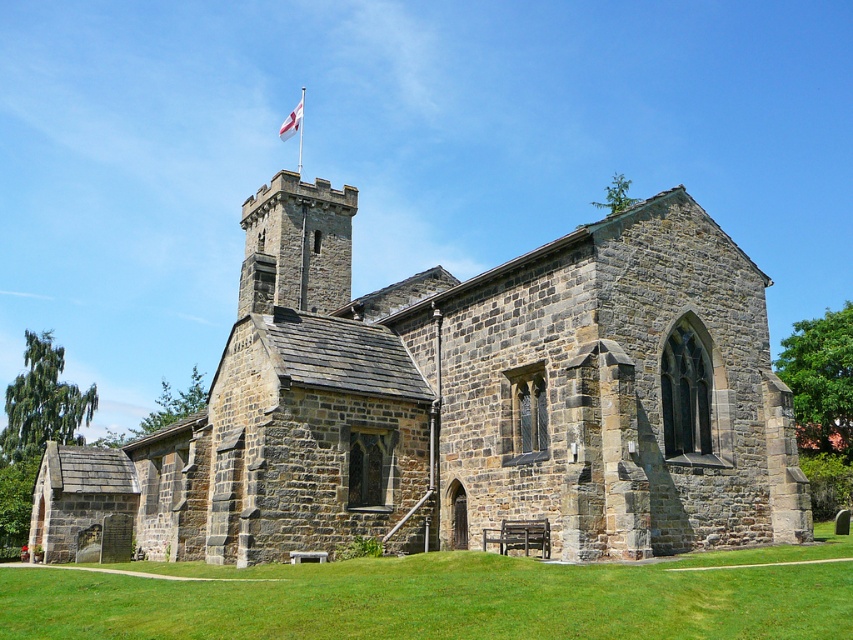
Question: Which object is positioned closest to the metallic flag pole at upper center?

Choices:
 (A) green grass at lower center
 (B) gray stone church at center
 (C) dark gray stone tower at center
 (D) white fabric flag at upper center

Answer: (D)

Question: Does white fabric flag at upper center have a lesser width compared to metallic flag pole at upper center?

Choices:
 (A) yes
 (B) no

Answer: (B)

Question: Is gray stone church at center bigger than white fabric flag at upper center?

Choices:
 (A) yes
 (B) no

Answer: (A)

Question: Among these points, which one is farthest from the camera?

Choices:
 (A) (277, 132)
 (B) (289, 256)
 (C) (167, 568)
 (D) (405, 358)

Answer: (A)

Question: Which point is farther from the camera taking this photo?

Choices:
 (A) click(756, 506)
 (B) click(288, 120)
 (C) click(299, 156)
 (D) click(412, 620)

Answer: (B)

Question: Is green grass at lower center smaller than white fabric flag at upper center?

Choices:
 (A) no
 (B) yes

Answer: (A)